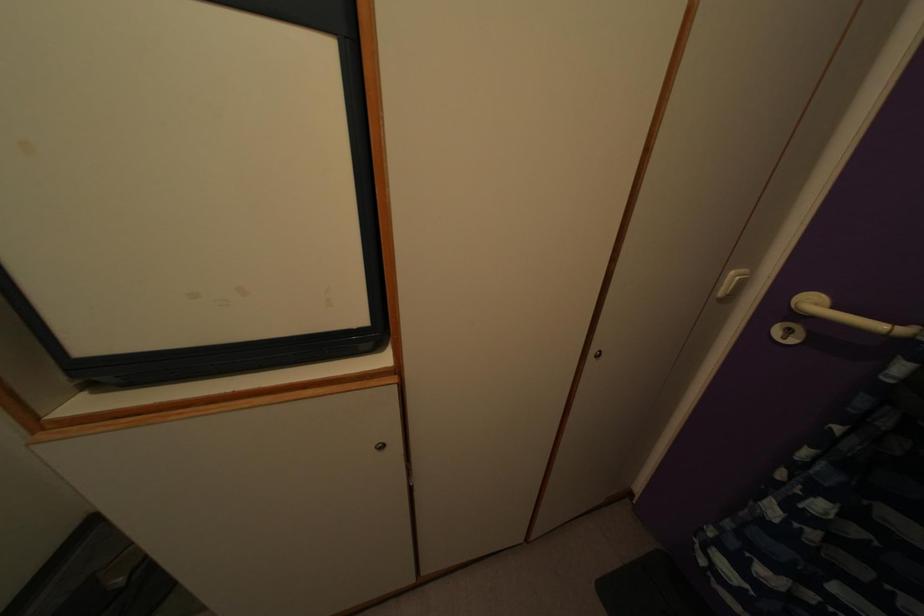
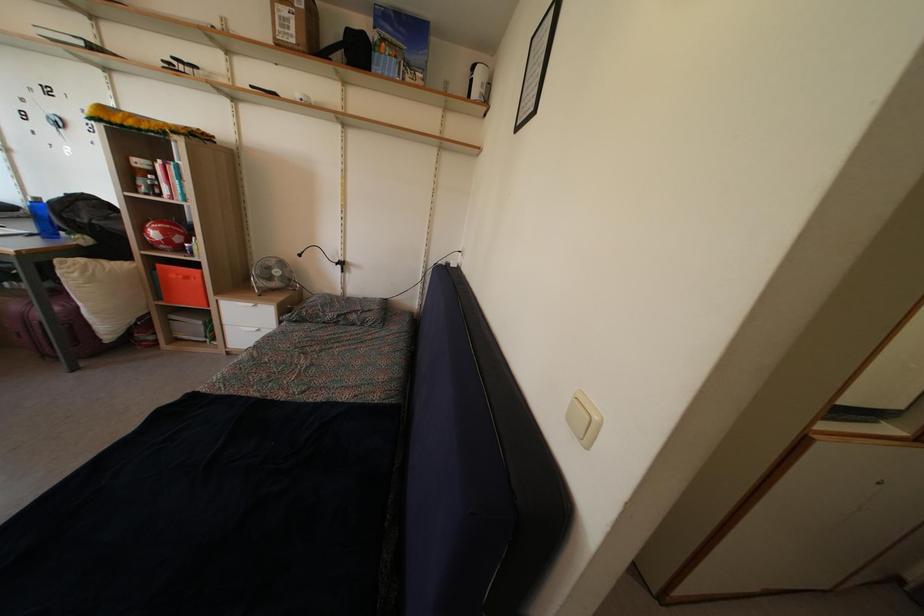
Question: What movement of the cameraman would produce the second image?

Choices:
 (A) Left
 (B) Right
 (C) Forward
 (D) Backward

Answer: (A)